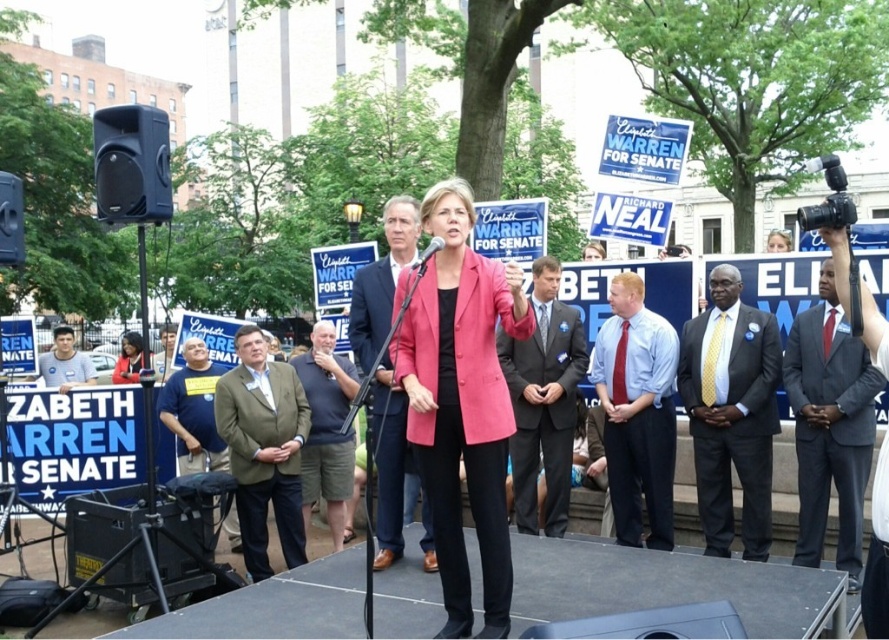
In the political rally scene, there is a dark gray suit at center and a metallic silver microphone at center. From the perspective of someone standing on the stage facing the crowd, which object is positioned to the right?

The dark gray suit at center is positioned to the right of the metallic silver microphone at center.

You are a photographer at the rally and want to capture a close shot of the speaker without moving closer than 15 feet. Is the current position of point (882, 552) within your desired range?

The distance of point (882, 552) from camera is 14.46 feet, which is closer than the 15 feet minimum distance you want to maintain. Therefore, you cannot capture a close shot from this position while adhering to your 15 feet rule.